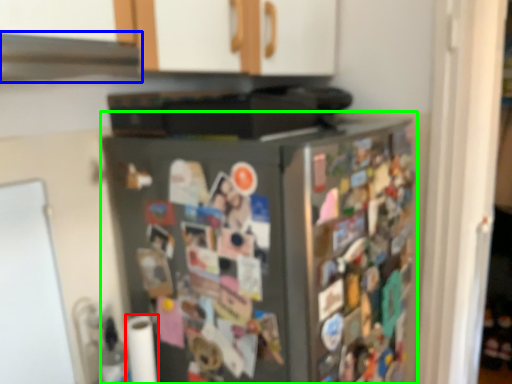
Question: Estimate the real-world distances between objects in this image. Which object is farther from toilet paper (highlighted by a red box), exhaust hood (highlighted by a blue box) or refrigerator (highlighted by a green box)?

Choices:
 (A) exhaust hood
 (B) refrigerator

Answer: (A)